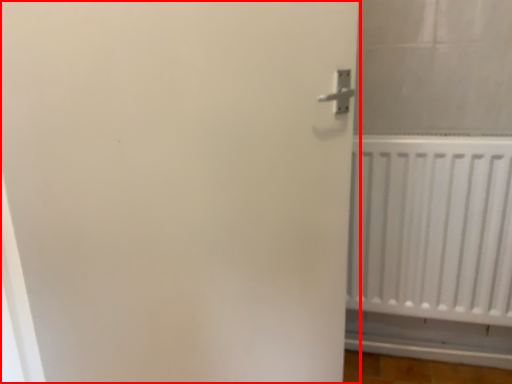
Question: From the image, what is the correct spatial relationship of door (annotated by the red box) in relation to radiator?

Choices:
 (A) right
 (B) left

Answer: (B)